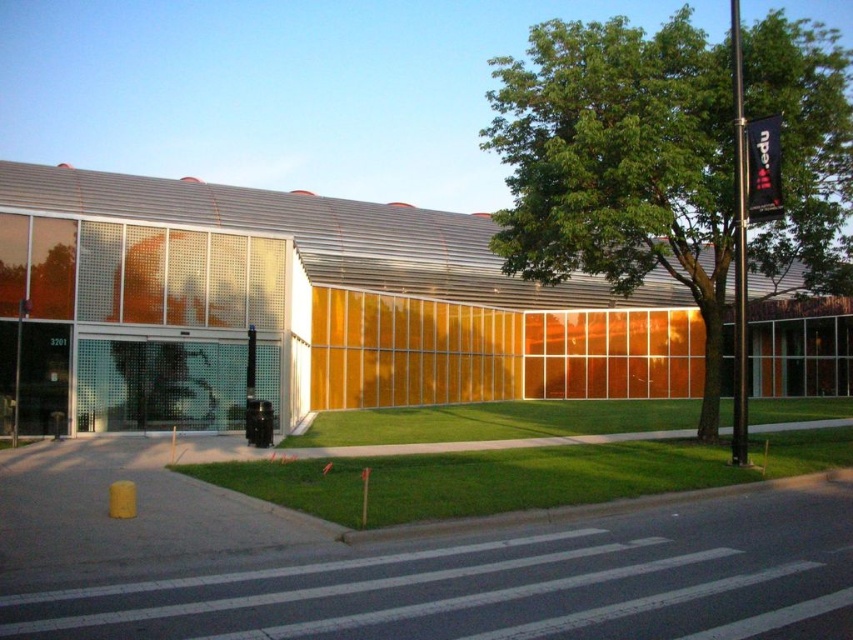
Is green grass at lower center thinner than black matte traffic light at center?

No.

Is green grass at lower center to the right of black matte traffic light at center from the viewer's perspective?

Indeed, green grass at lower center is positioned on the right side of black matte traffic light at center.

Does point (416, 472) come closer to viewer compared to point (247, 404)?

Yes, point (416, 472) is closer to viewer.

The width and height of the screenshot is (853, 640). Identify the location of green grass at lower center. (517, 476).

Who is more distant from viewer, (x=668, y=22) or (x=350, y=502)?

Positioned behind is point (x=668, y=22).

Is green leafy tree at upper right in front of green grass at lower center?

That is False.

Does point (843, 186) come closer to viewer compared to point (593, 470)?

No, it is behind (593, 470).

The height and width of the screenshot is (640, 853). Identify the location of green leafy tree at upper right. (619, 163).

Is green leafy tree at upper right below black matte traffic light at center?

Actually, green leafy tree at upper right is above black matte traffic light at center.

Identify the location of green leafy tree at upper right. (619, 163).

Image resolution: width=853 pixels, height=640 pixels. I want to click on green leafy tree at upper right, so click(619, 163).